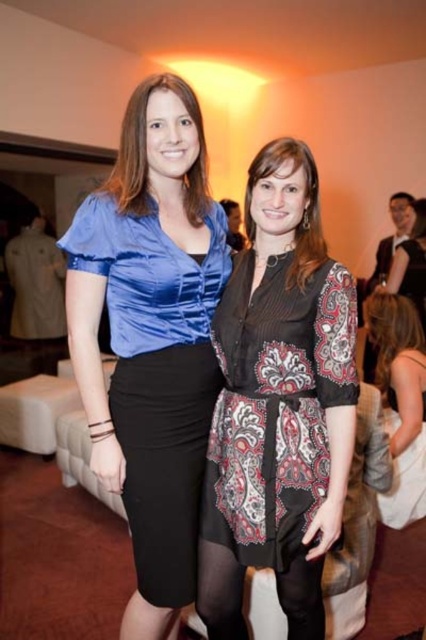
Question: Among these objects, which one is nearest to the camera?

Choices:
 (A) white satin dress at lower right
 (B) shiny blue blouse at left
 (C) paisley-patterned dress at center

Answer: (B)

Question: Which object is the farthest from the shiny blue blouse at left?

Choices:
 (A) paisley-patterned dress at center
 (B) white satin dress at lower right

Answer: (B)

Question: Is paisley-patterned dress at center positioned behind white satin dress at lower right?

Choices:
 (A) yes
 (B) no

Answer: (B)

Question: Does shiny blue blouse at left appear on the right side of white satin dress at lower right?

Choices:
 (A) no
 (B) yes

Answer: (A)

Question: Which of these objects is positioned closest to the shiny blue blouse at left?

Choices:
 (A) paisley-patterned dress at center
 (B) white satin dress at lower right

Answer: (A)

Question: Can you confirm if paisley-patterned dress at center is smaller than white satin dress at lower right?

Choices:
 (A) yes
 (B) no

Answer: (B)